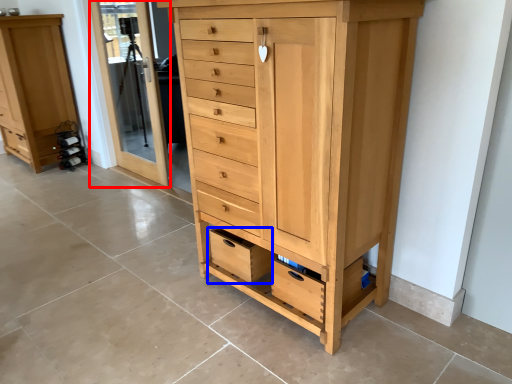
Question: Which object is further to the camera taking this photo, screen door (highlighted by a red box) or drawer (highlighted by a blue box)?

Choices:
 (A) screen door
 (B) drawer

Answer: (A)